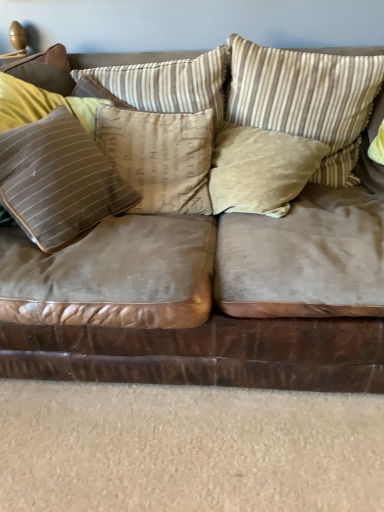
Question: From the image's perspective, is brown suede couch at center located above or below brown striped cushion at center, which is the 3th pillow from right to left?

Choices:
 (A) above
 (B) below

Answer: (B)

Question: Does point (296, 379) appear closer or farther from the camera than point (172, 175)?

Choices:
 (A) closer
 (B) farther

Answer: (A)

Question: Which object is positioned farthest from the velvet beige pillow at center, the second pillow in the right-to-left sequence?

Choices:
 (A) brown striped cushion at center, the 3th pillow positioned from the left
 (B) brown striped pillow at center, the fourth pillow viewed from the right
 (C) suede-like brown pillow at left, which ranks as the first pillow in left-to-right order
 (D) brown suede couch at center
 (E) brown striped pillow at upper right, the 5th pillow when ordered from left to right

Answer: (C)

Question: Considering the real-world distances, which object is farthest from the brown suede couch at center?

Choices:
 (A) velvet beige pillow at center, which is counted as the fourth pillow, starting from the left
 (B) brown striped pillow at upper right, which is the 1th pillow from right to left
 (C) brown striped pillow at center, the fourth pillow viewed from the right
 (D) suede-like brown pillow at left, which appears as the fifth pillow when viewed from the right
 (E) brown striped cushion at center, the 3th pillow positioned from the left

Answer: (C)